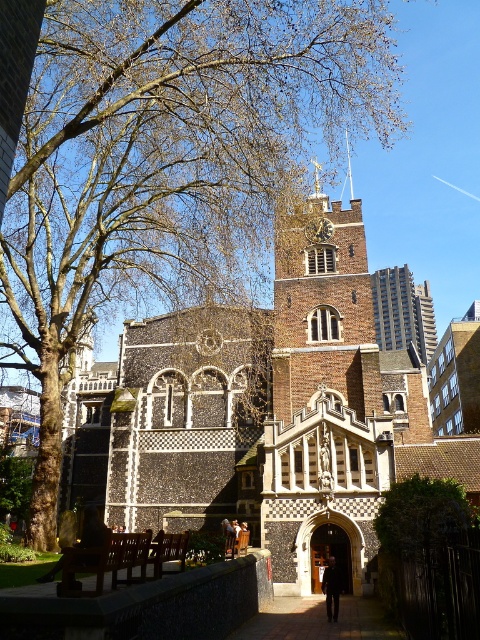
Does brick pathway at center have a smaller size compared to smooth silver spire at upper center?

Correct, brick pathway at center occupies less space than smooth silver spire at upper center.

Is brick pathway at center to the left of smooth silver spire at upper center from the viewer's perspective?

Yes, brick pathway at center is to the left of smooth silver spire at upper center.

Does point (308, 612) lie behind point (349, 188)?

That is False.

This screenshot has width=480, height=640. Find the location of `brick pathway at center`. brick pathway at center is located at coordinates (317, 620).

Measure the distance from dark wool coat at center to smooth silver spire at upper center.

dark wool coat at center and smooth silver spire at upper center are 126.25 meters apart from each other.

Between dark wool coat at center and smooth silver spire at upper center, which one has more height?

smooth silver spire at upper center is taller.

I want to click on dark wool coat at center, so click(x=332, y=588).

Identify the location of dark wool coat at center. This screenshot has width=480, height=640. (332, 588).

Is brown brick tower at center positioned at the back of smooth silver spire at upper center?

No.

Between brown brick tower at center and smooth silver spire at upper center, which one appears on the left side from the viewer's perspective?

brown brick tower at center

Which is in front, point (363, 400) or point (349, 173)?

Point (363, 400)

Identify the location of brown brick tower at center. The height and width of the screenshot is (640, 480). point(323,401).